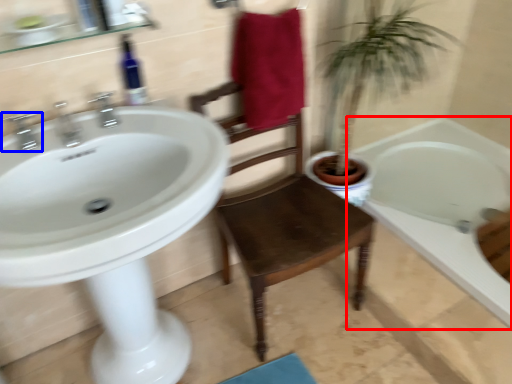
Question: Which point is further to the camera, bathtub (highlighted by a red box) or tap (highlighted by a blue box)?

Choices:
 (A) bathtub
 (B) tap

Answer: (A)